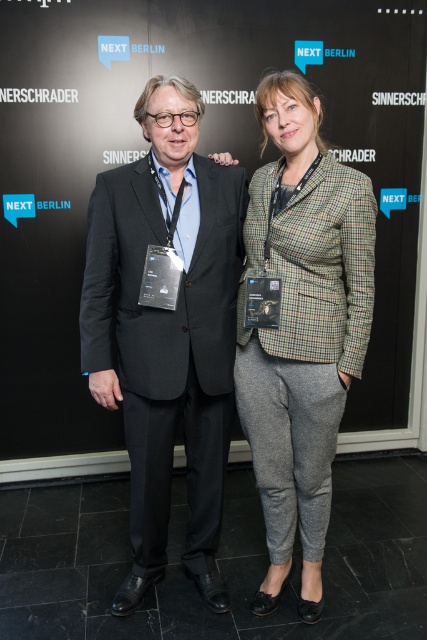
You are standing in front of the backdrop with the text NEXT BERLIN. There are two points marked on the image, point 1 at coordinates point (160, 388) and point 2 at coordinates point (359, 173). Which point is closer to you?

Point (160, 388) is closer to you than point (359, 173).

You are organizing a clothing display and need to arrange the black fabric at center and the plaid wool blazer at center side by side. Based on their widths, which item should be placed on the left to ensure proper alignment?

The black fabric at center should be placed on the left since its width surpasses that of the plaid wool blazer at center, allowing for better alignment when placed first.

You are taking a photo of two points in the image. The first point is at coordinate point (415, 410) and the second is at point (163, 570). Which point is closer to the camera?

Point (163, 570) is closer to the camera than point (415, 410) because the description states that point (415, 410) is further away.